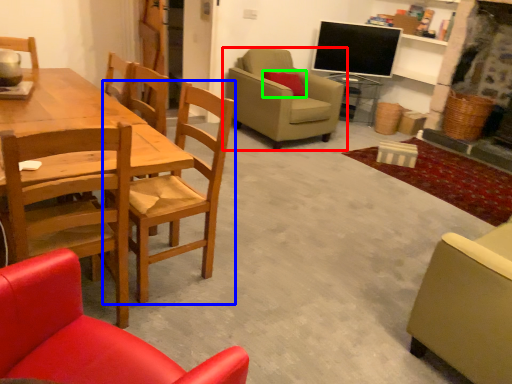
Question: Which object is the closest to the chair (highlighted by a red box)? Choose among these: chair (highlighted by a blue box) or pillow (highlighted by a green box).

Choices:
 (A) chair
 (B) pillow

Answer: (B)